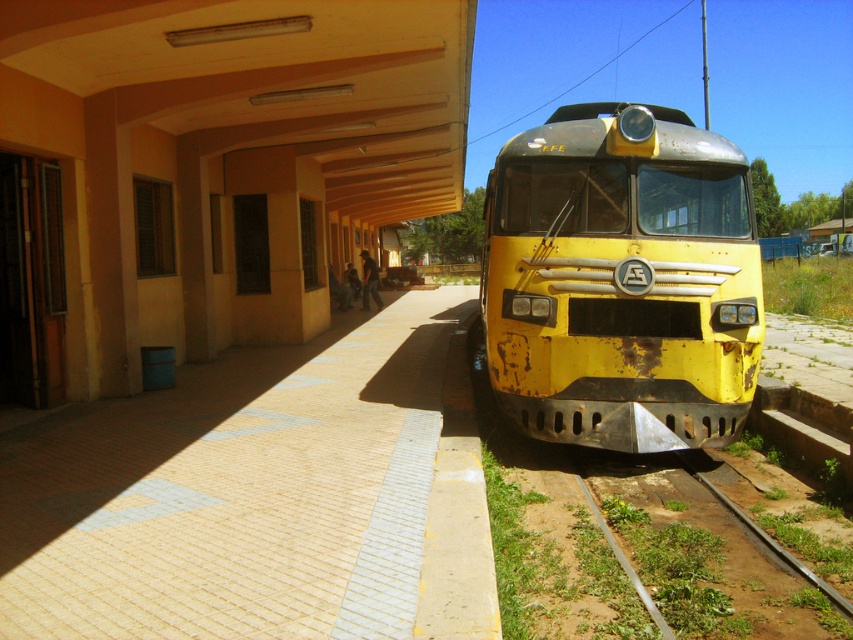
You are a maintenance worker who needs to determine if the yellow matte train at center can pass under a low clearance bridge that is the same height as the green grassy track at lower right. Based on the scene, can the train pass under the bridge?

The yellow matte train at center is taller than the green grassy track at lower right. Since the bridge has the same height as the track, the train cannot pass under the bridge because it is taller than the clearance height provided by the bridge.

You are a maintenance worker needing to access the green grassy track at lower right for inspection. There is a brick pavement at center in your way. Can you walk around it to reach the track?

The brick pavement at center is above the green grassy track at lower right, so you cannot walk around it directly. You need to find another path or go around the structure to reach the track.

You are a delivery person carrying a large box that is 2 meters in length. You need to place it on the brick pavement at center or the yellow matte train at center. Which surface can accommodate the box based on their sizes?

The yellow matte train at center has a larger size compared to the brick pavement at center, so the box can be placed on the yellow matte train at center.